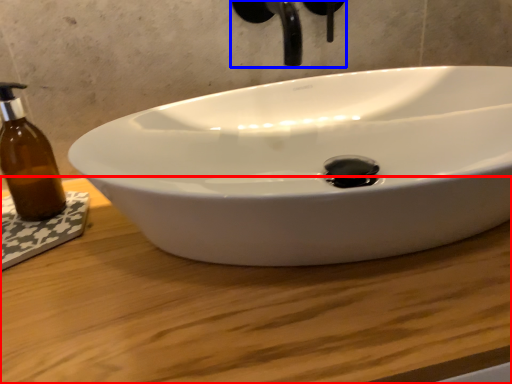
Question: Among these objects, which one is farthest to the camera, counter top (highlighted by a red box) or plumbing fixture (highlighted by a blue box)?

Choices:
 (A) counter top
 (B) plumbing fixture

Answer: (B)